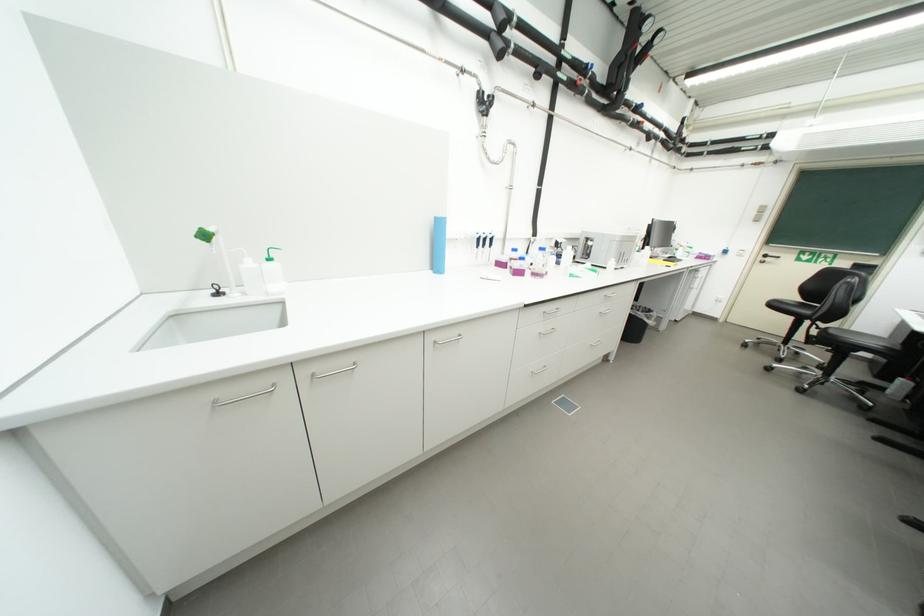
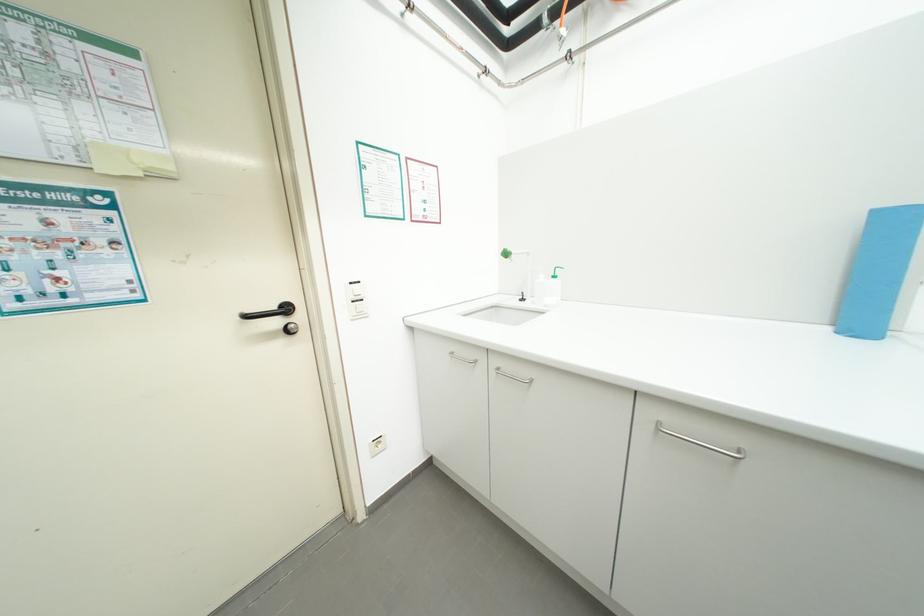
Question: Based on the continuous images, in which direction is the camera rotating? Reply with the corresponding letter.

Choices:
 (A) Left
 (B) Right
 (C) Up
 (D) Down

Answer: (A)